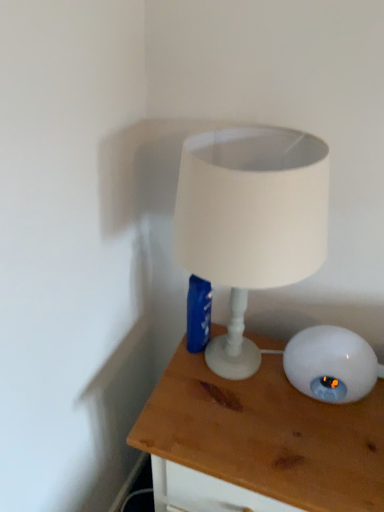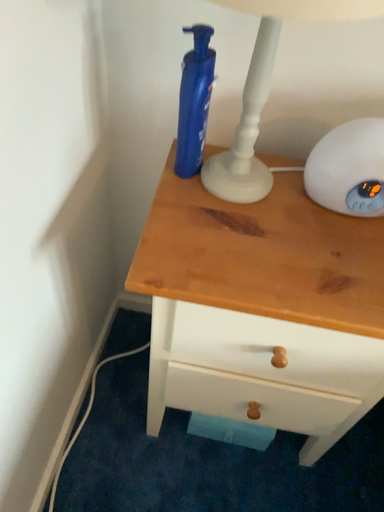
Question: How did the camera likely rotate when shooting the video?

Choices:
 (A) rotated downward
 (B) rotated upward

Answer: (A)